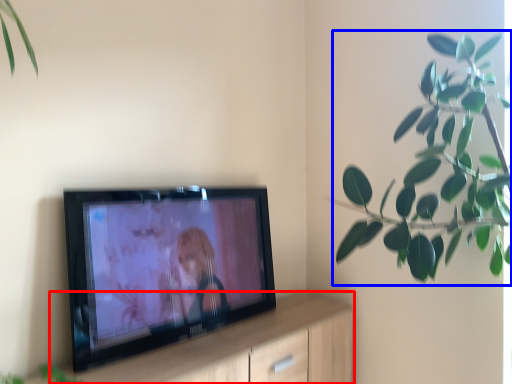
Question: Which point is closer to the camera, dresser (highlighted by a red box) or houseplant (highlighted by a blue box)?

Choices:
 (A) dresser
 (B) houseplant

Answer: (A)